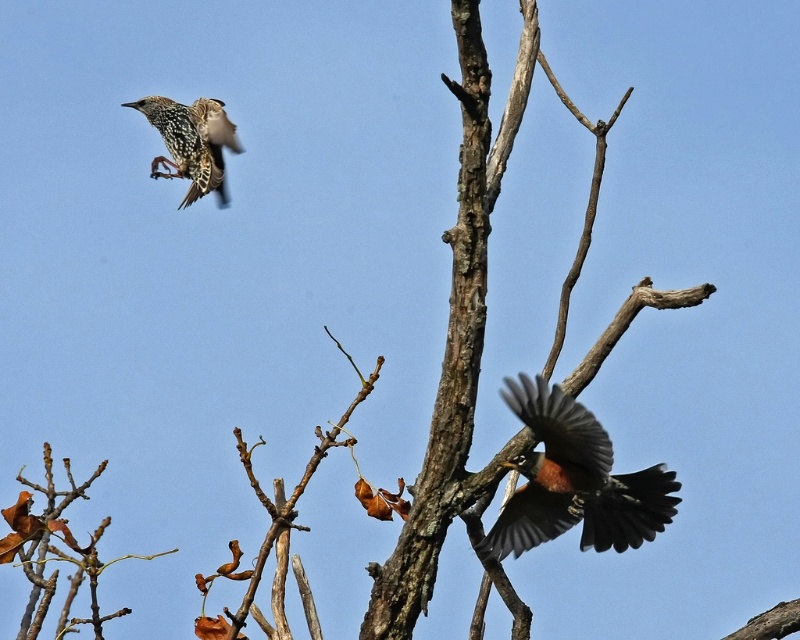
You are a birdwatcher observing two birds in flight against a clear blue sky. You notice a point at coordinates (574, 481). Which bird does this point correspond to?

The point at coordinates (574, 481) corresponds to the reddish brown feathered bird at lower right.